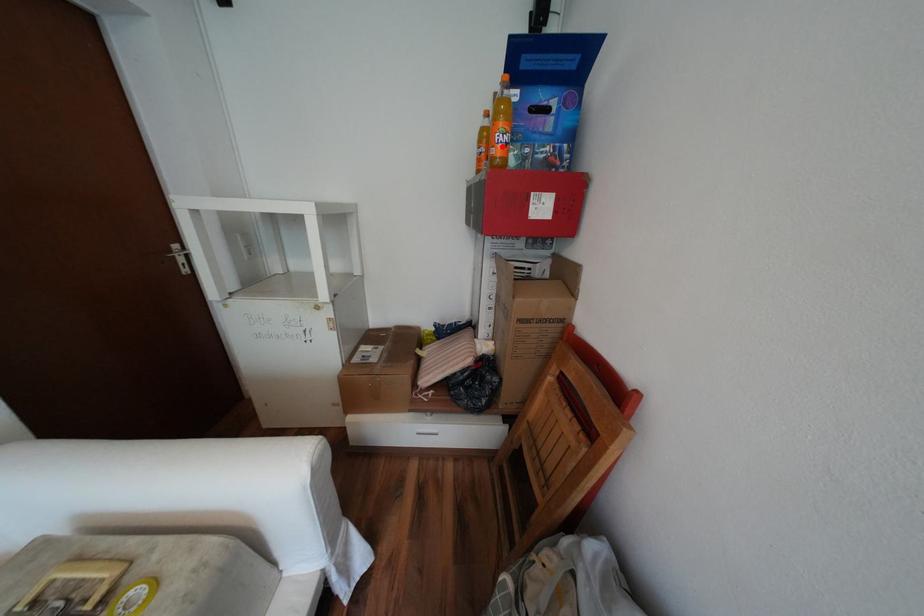
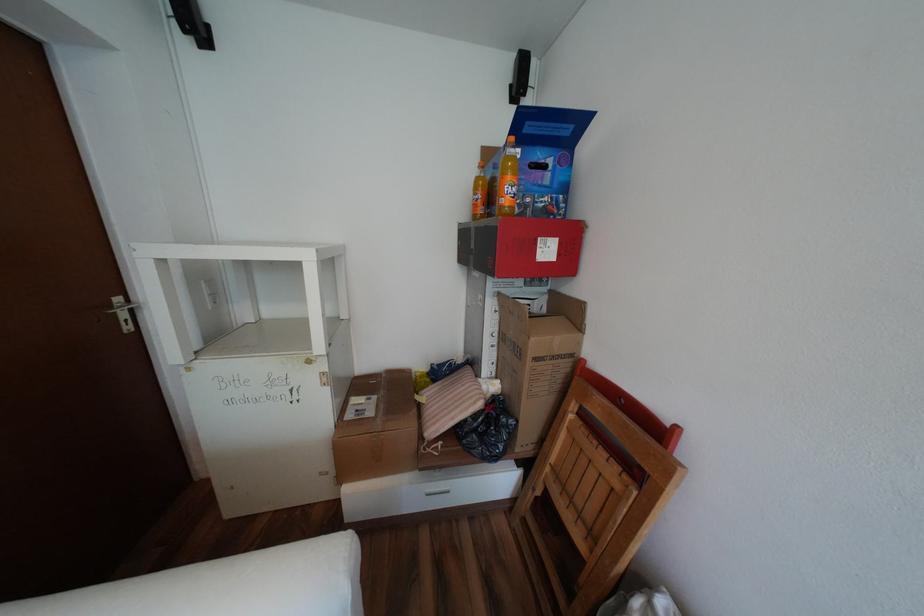
Where in the second image is the point corresponding to the highlighted location from the first image?

(512, 197)